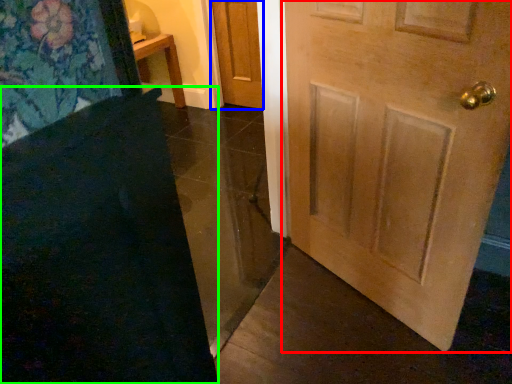
Question: Which is farther away from door (highlighted by a red box)? door (highlighted by a blue box) or doormat (highlighted by a green box)?

Choices:
 (A) door
 (B) doormat

Answer: (A)